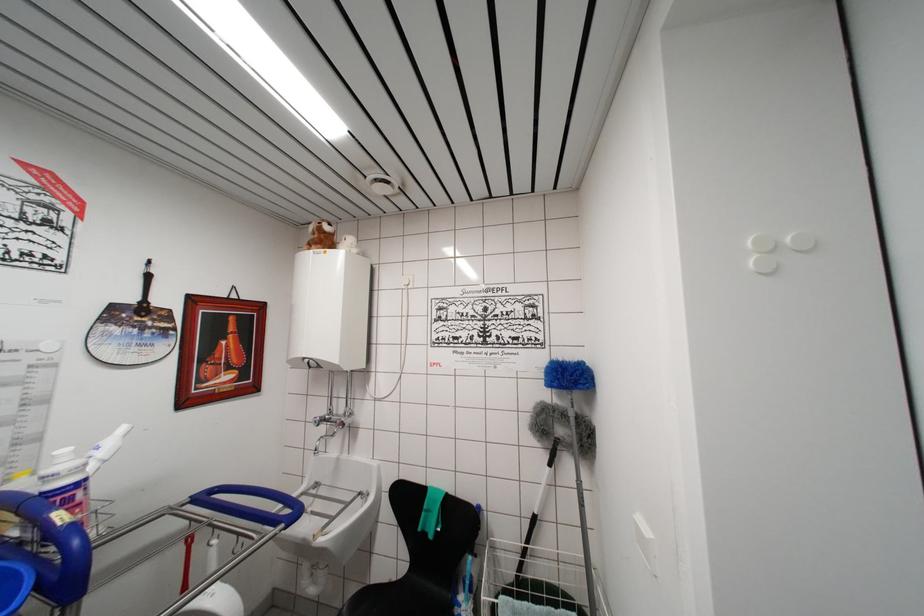
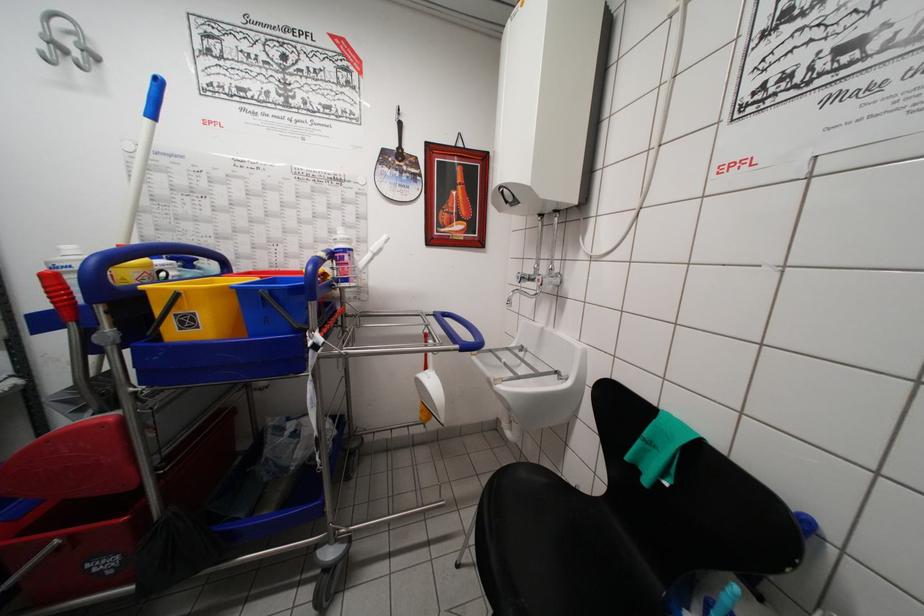
Question: The first image is from the beginning of the video and the second image is from the end. How did the camera likely rotate when shooting the video?

Choices:
 (A) Left
 (B) Right
 (C) Up
 (D) Down

Answer: (A)